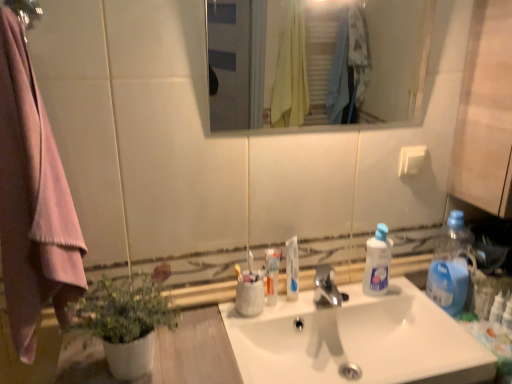
Locate an element on the screen. The image size is (512, 384). free spot in front of white glossy toothpaste at center, the 2th toothpaste from the left is located at coordinates (284, 323).